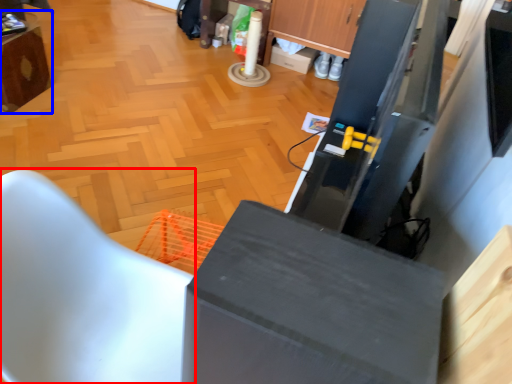
Question: Among these objects, which one is nearest to the camera, furniture (highlighted by a red box) or furniture (highlighted by a blue box)?

Choices:
 (A) furniture
 (B) furniture

Answer: (A)